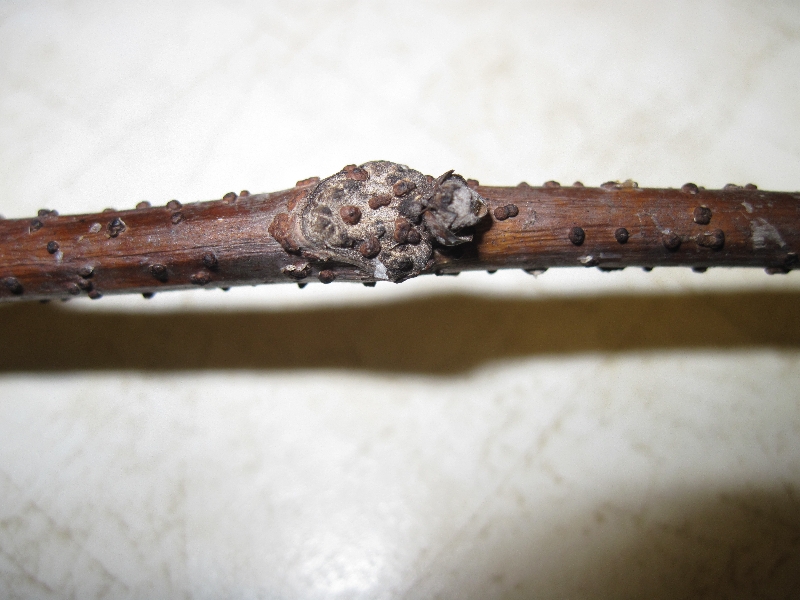
You are a GUI agent. You are given a task and a screenshot of the screen. Output one action in this format:
    pyautogui.click(x=<x>, y=<y>)
    Task: Click on the dark shadow on floor
    The width and height of the screenshot is (800, 600).
    Given the screenshot: What is the action you would take?
    pyautogui.click(x=777, y=581)